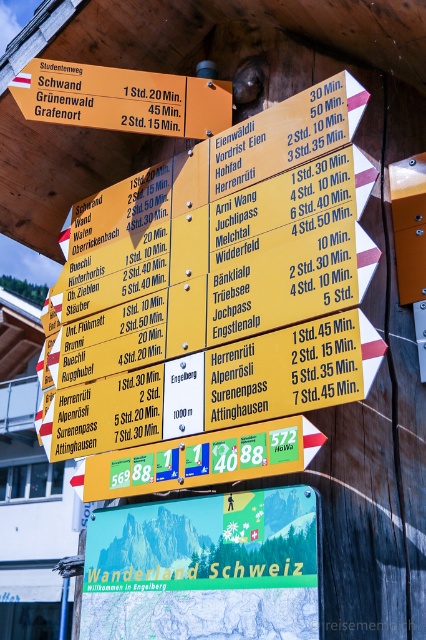
You are a hiker trying to reach the nearest Swiss Hiking Land information. You see the green matte sign at center and the yellow wood sign at upper center. Which sign is located lower in the image?

The green matte sign at center is located lower because it is below the yellow wood sign at upper center.

You are standing in front of the cluster of directional signs at the mountain hut. You notice two points marked on the signs, one at coordinate point (268, 588) and another at point (206, 90). Which of these points is nearer to your current position?

Point (268, 588) is closer to the viewer than point (206, 90), so the point at coordinate (268, 588) is nearer to your current position.

You are a hiker trying to find the green matte sign at center. According to the scene description, where should you look relative to the cluster of directional signs?

The green matte sign at center is located at point [204,568], which is below the cluster of directional signs mounted on a wooden structure.